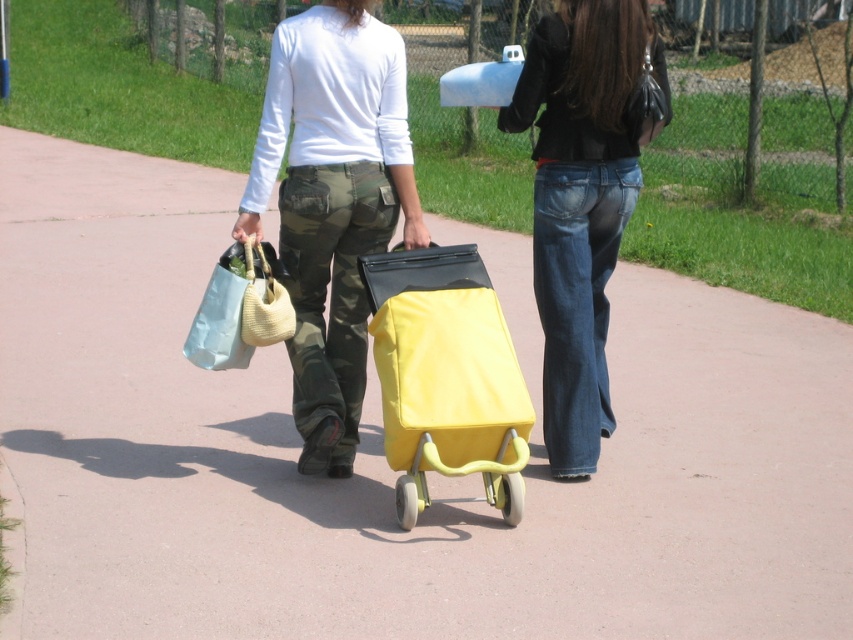
You are a photographer trying to capture a clear shot of the camo pants at center and the yellow matte shopping cart at center. Since both are in the same area, which one is blocking the view of the other?

The camo pants at center is positioned over yellow matte shopping cart at center, so it is blocking the view of the yellow matte shopping cart at center.

You are a photographer trying to capture both the denim jeans at center and the matte fabric bag at center in a single frame. Given that your camera has a fixed focal length, which object should you focus on to ensure both are in focus, considering their sizes?

You should focus on the denim jeans at center because it has a larger size compared to the matte fabric bag at center, making it easier to keep both in focus when focusing on the larger object.

You are a photographer trying to capture both the camo pants at center and the yellow matte shopping cart at center in a single frame. Based on their sizes, which object should you focus on to ensure both fit in the photo?

The camo pants at center is bigger than the yellow matte shopping cart at center, so focusing on the camo pants at center will help ensure both objects fit in the photo since it takes up more space.